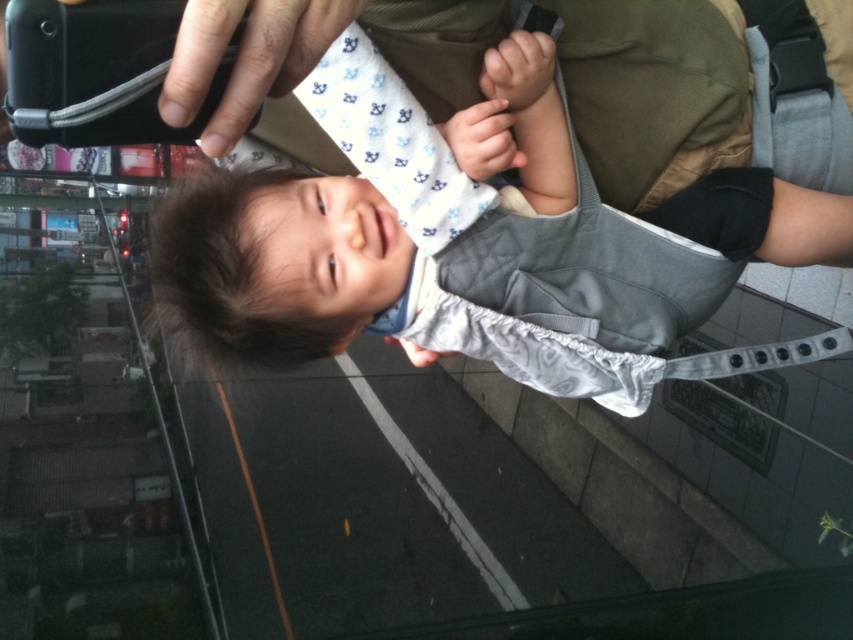
You are a photographer trying to capture a candid shot of the baby in the carrier. You notice the black matte phone at upper left and the smooth white hand at center. Which object is closer to the camera?

The smooth white hand at center is closer to the camera than the black matte phone at upper left because the phone is positioned under the hand.

You are a photographer trying to capture the baby in the matte gray baby carrier at center. You want to position your camera exactly at the center point of the carrier. What coordinates should you aim for?

You should aim for the coordinates at point (474, 243) to position your camera exactly at the center point of the matte gray baby carrier at center.

You are a photographer trying to capture a closeup of the baby in the matte gray baby carrier at center. Since the smooth white hand at center is holding a phone, do you think the hand will block the view of the baby?

The matte gray baby carrier at center is closer to the viewer than the smooth white hand at center, so the baby carrier will block the hand, meaning the hand won not block the view of the baby.